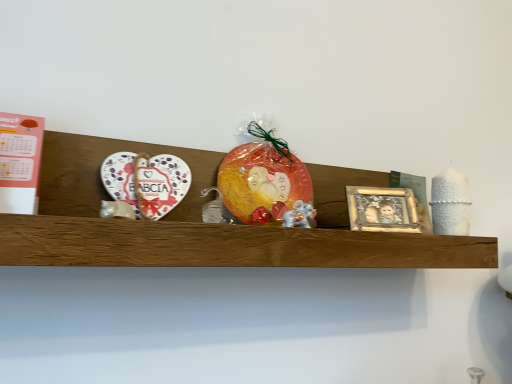
The width and height of the screenshot is (512, 384). I want to click on wooden shelf at center, so click(x=207, y=224).

What do you see at coordinates (300, 215) in the screenshot? I see `white glossy mouse at center` at bounding box center [300, 215].

The width and height of the screenshot is (512, 384). I want to click on wooden shelf at center, so click(x=207, y=224).

Does gold metallic picture frame at center-right appear on the right side of wooden shelf at center?

Yes, gold metallic picture frame at center-right is to the right of wooden shelf at center.

This screenshot has height=384, width=512. In order to click on picture frame that appears on the right of wooden shelf at center in this screenshot , I will do `click(382, 209)`.

How distant is gold metallic picture frame at center-right from wooden shelf at center?

A distance of 8.29 inches exists between gold metallic picture frame at center-right and wooden shelf at center.

Is gold metallic picture frame at center-right not inside wooden shelf at center?

No, gold metallic picture frame at center-right is not entirely external to wooden shelf at center.

Which is farther, (292, 214) or (173, 169)?

The point (173, 169) is more distant.

Considering the relative positions of white glossy mouse at center and white ceramic heart at left in the image provided, is white glossy mouse at center behind white ceramic heart at left?

Yes, white glossy mouse at center is further from the camera.

This screenshot has width=512, height=384. Identify the location of platter above the white glossy mouse at center (from a real-world perspective). (146, 182).

How much distance is there between white glossy mouse at center and white ceramic heart at left?

white glossy mouse at center is 9.01 inches away from white ceramic heart at left.

From the image's perspective, relative to gold metallic picture frame at center-right, is white ceramic heart at left above or below?

white ceramic heart at left is situated higher than gold metallic picture frame at center-right in the image.

In the scene shown: Between white ceramic heart at left and gold metallic picture frame at center-right, which one has smaller width?

white ceramic heart at left.

Considering their positions, is white ceramic heart at left located in front of or behind gold metallic picture frame at center-right?

white ceramic heart at left is positioned closer to the viewer than gold metallic picture frame at center-right.

Is gold metallic picture frame at center-right a part of white ceramic heart at left?

No, gold metallic picture frame at center-right is located outside of white ceramic heart at left.

Is gold metallic picture frame at center-right in contact with white glossy mouse at center?

No, gold metallic picture frame at center-right is not touching white glossy mouse at center.

Is gold metallic picture frame at center-right taller or shorter than white glossy mouse at center?

gold metallic picture frame at center-right is taller than white glossy mouse at center.

Which object is more forward, gold metallic picture frame at center-right or white glossy mouse at center?

white glossy mouse at center is in front.

From the picture: Is gold metallic picture frame at center-right not inside white glossy mouse at center?

Yes.

Between white glossy mouse at center and wooden shelf at center, which one is positioned behind?

white glossy mouse at center is further from the camera.

Identify the location of stuff lying behind the wooden shelf at center. This screenshot has width=512, height=384. tap(300, 215).

Is point (303, 227) in front of point (435, 245)?

That is True.

Does white glossy mouse at center turn towards wooden shelf at center?

Yes.

Based on the photo, considering the relative positions of white ceramic heart at left and white glossy mouse at center in the image provided, is white ceramic heart at left to the left or to the right of white glossy mouse at center?

From the image, it's evident that white ceramic heart at left is to the left of white glossy mouse at center.

Identify the location of stuff below the white ceramic heart at left (from a real-world perspective). (300, 215).

From their relative heights in the image, would you say white ceramic heart at left is taller or shorter than white glossy mouse at center?

Considering their sizes, white ceramic heart at left has more height than white glossy mouse at center.

Is wooden shelf at center outside of gold metallic picture frame at center-right?

Yes, wooden shelf at center is not within gold metallic picture frame at center-right.

From a real-world perspective, is wooden shelf at center physically located above or below gold metallic picture frame at center-right?

From a real-world perspective, wooden shelf at center is physically below gold metallic picture frame at center-right.

Based on the photo, can you confirm if wooden shelf at center is positioned to the left of gold metallic picture frame at center-right?

Indeed, wooden shelf at center is positioned on the left side of gold metallic picture frame at center-right.

Locate an element on the screen. The width and height of the screenshot is (512, 384). picture frame below the wooden shelf at center (from the image's perspective) is located at coordinates (382, 209).

Find the location of `platter above the white glossy mouse at center (from the image's perspective)`. platter above the white glossy mouse at center (from the image's perspective) is located at coordinates (146, 182).

From the image, which object appears to be nearer to white ceramic heart at left, wooden shelf at center or white glossy mouse at center?

wooden shelf at center is closer to white ceramic heart at left.

Considering their positions, is white glossy mouse at center positioned closer to gold metallic picture frame at center-right than white ceramic heart at left?

Among the two, white glossy mouse at center is located nearer to gold metallic picture frame at center-right.

Which object lies nearer to the anchor point gold metallic picture frame at center-right, wooden shelf at center or translucent plastic bag at center?

The object closer to gold metallic picture frame at center-right is translucent plastic bag at center.

Estimate the real-world distances between objects in this image. Which object is further from white glossy mouse at center, gold metallic picture frame at center-right or translucent plastic bag at center?

gold metallic picture frame at center-right is positioned further to the anchor white glossy mouse at center.

Estimate the real-world distances between objects in this image. Which object is closer to white glossy mouse at center, translucent plastic bag at center or wooden shelf at center?

translucent plastic bag at center lies closer to white glossy mouse at center than the other object.

Estimate the real-world distances between objects in this image. Which object is further from translucent plastic bag at center, white ceramic heart at left or white glossy mouse at center?

Based on the image, white ceramic heart at left appears to be further to translucent plastic bag at center.

Estimate the real-world distances between objects in this image. Which object is closer to gold metallic picture frame at center-right, wooden shelf at center or white ceramic heart at left?

The object closer to gold metallic picture frame at center-right is wooden shelf at center.

Looking at the image, which one is located further to translucent plastic bag at center, wooden shelf at center or white ceramic heart at left?

The object further to translucent plastic bag at center is wooden shelf at center.

Where is `stuff between wooden shelf at center and gold metallic picture frame at center-right in the front-back direction`? stuff between wooden shelf at center and gold metallic picture frame at center-right in the front-back direction is located at coordinates (300, 215).

In order to click on stuff located between wooden shelf at center and translucent plastic bag at center in the depth direction in this screenshot , I will do 300,215.

This screenshot has width=512, height=384. In order to click on stuff located between white ceramic heart at left and gold metallic picture frame at center-right in the left-right direction in this screenshot , I will do `click(300, 215)`.

The width and height of the screenshot is (512, 384). In order to click on stuff between translucent plastic bag at center and gold metallic picture frame at center-right in this screenshot , I will do `click(300, 215)`.